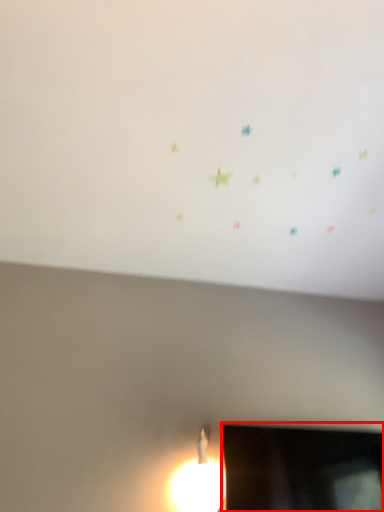
Question: In this image, where is television (annotated by the red box) located relative to backdrop?

Choices:
 (A) right
 (B) left

Answer: (A)